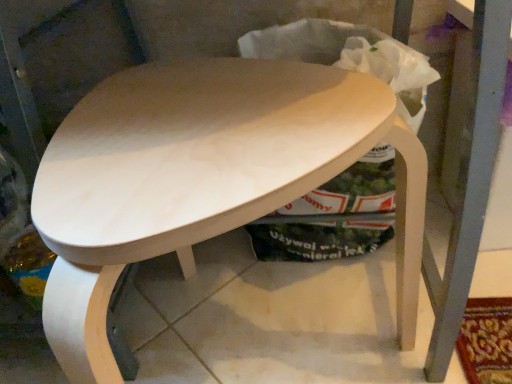
Where is `white paper bag at upper center`? white paper bag at upper center is located at coordinates (349, 56).

The height and width of the screenshot is (384, 512). Describe the element at coordinates (349, 56) in the screenshot. I see `white paper bag at upper center` at that location.

What is the approximate width of white paper bag at upper center?

11.41 inches.

This screenshot has width=512, height=384. I want to click on white paper bag at upper center, so click(349, 56).